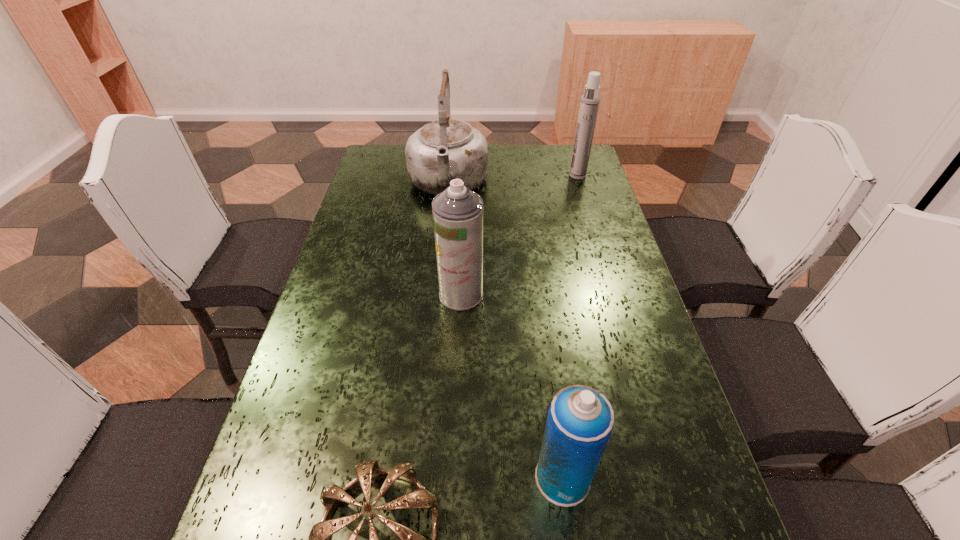
Find the location of a particular element. aerosol can that is the second closest to the nearest aerosol can is located at coordinates (589, 104).

You are a GUI agent. You are given a task and a screenshot of the screen. Output one action in this format:
    pyautogui.click(x=<x>, y=<y>)
    Task: Click on the aerosol can that is the second closest to the second farthest aerosol can
    The image size is (960, 540).
    Given the screenshot: What is the action you would take?
    pyautogui.click(x=589, y=104)

Identify the location of vacant space that satisfies the following two spatial constraints: 1. on the back side of the rightmost object; 2. on the left side of the second farthest aerosol can. The image size is (960, 540). (467, 176).